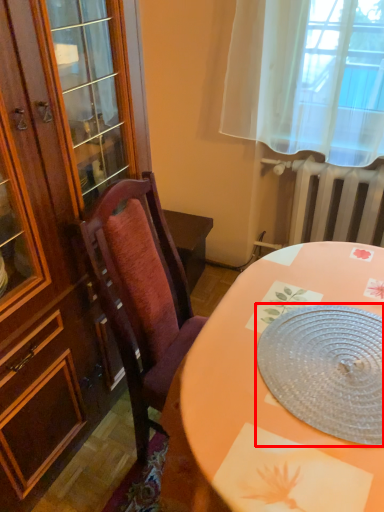
Question: In this image, where is platter (annotated by the red box) located relative to radiator?

Choices:
 (A) left
 (B) right

Answer: (A)